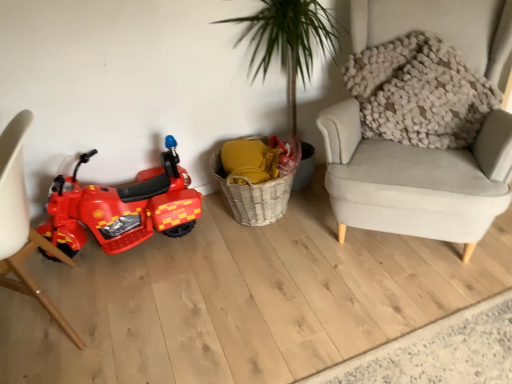
Question: Is shiny plastic toy motorcycle at left not within matte white chair at left?

Choices:
 (A) no
 (B) yes

Answer: (B)

Question: Is matte white chair at left completely or partially inside shiny plastic toy motorcycle at left?

Choices:
 (A) no
 (B) yes

Answer: (A)

Question: Can you confirm if shiny plastic toy motorcycle at left is bigger than matte white chair at left?

Choices:
 (A) yes
 (B) no

Answer: (B)

Question: Is shiny plastic toy motorcycle at left in front of matte white chair at left?

Choices:
 (A) no
 (B) yes

Answer: (A)

Question: Considering the relative sizes of shiny plastic toy motorcycle at left and matte white chair at left in the image provided, is shiny plastic toy motorcycle at left wider than matte white chair at left?

Choices:
 (A) no
 (B) yes

Answer: (A)

Question: Can you confirm if shiny plastic toy motorcycle at left is thinner than matte white chair at left?

Choices:
 (A) yes
 (B) no

Answer: (A)

Question: Is shiny plastic toy motorcycle at left oriented away from woven basket at center?

Choices:
 (A) yes
 (B) no

Answer: (B)

Question: Is shiny plastic toy motorcycle at left further to the viewer compared to woven basket at center?

Choices:
 (A) no
 (B) yes

Answer: (A)

Question: Is there a large distance between shiny plastic toy motorcycle at left and woven basket at center?

Choices:
 (A) no
 (B) yes

Answer: (A)

Question: From the image's perspective, would you say shiny plastic toy motorcycle at left is shown under woven basket at center?

Choices:
 (A) yes
 (B) no

Answer: (A)

Question: From the image's perspective, does shiny plastic toy motorcycle at left appear higher than woven basket at center?

Choices:
 (A) yes
 (B) no

Answer: (B)

Question: Is shiny plastic toy motorcycle at left in front of woven basket at center?

Choices:
 (A) yes
 (B) no

Answer: (A)

Question: Does woven basket at center have a greater width compared to shiny plastic toy motorcycle at left?

Choices:
 (A) yes
 (B) no

Answer: (A)